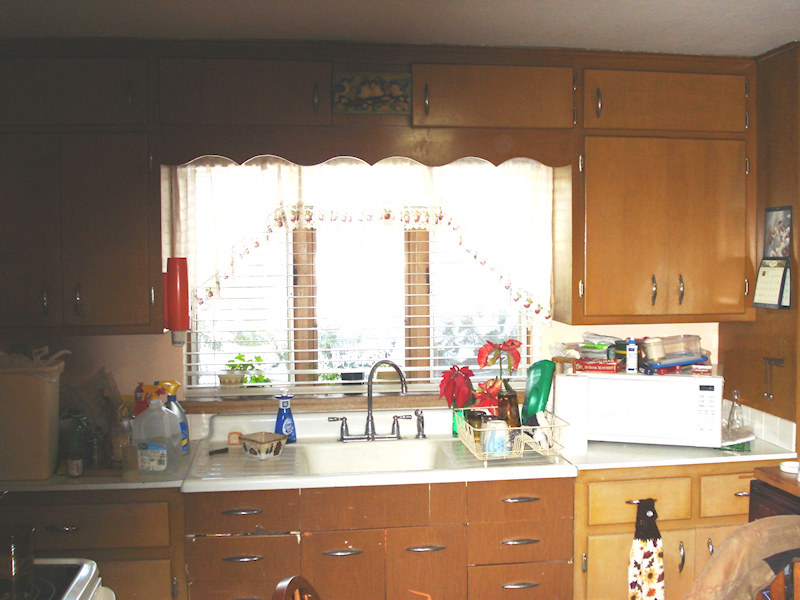
Locate an element on the screen. This screenshot has height=600, width=800. jacket hanging over chair is located at coordinates (780, 548).